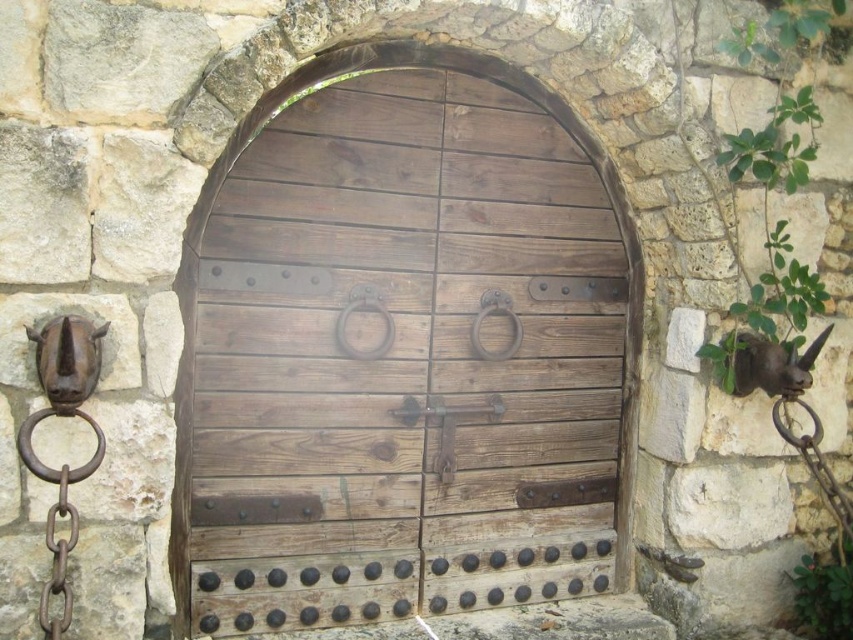
You are a painter standing at the base of the stone archway. You need to paint the wooden door at center and the rustic metal door handle at center. Which object will require you to reach higher to paint?

The wooden door at center requires reaching higher because it has a greater height than the rustic metal door handle at center.